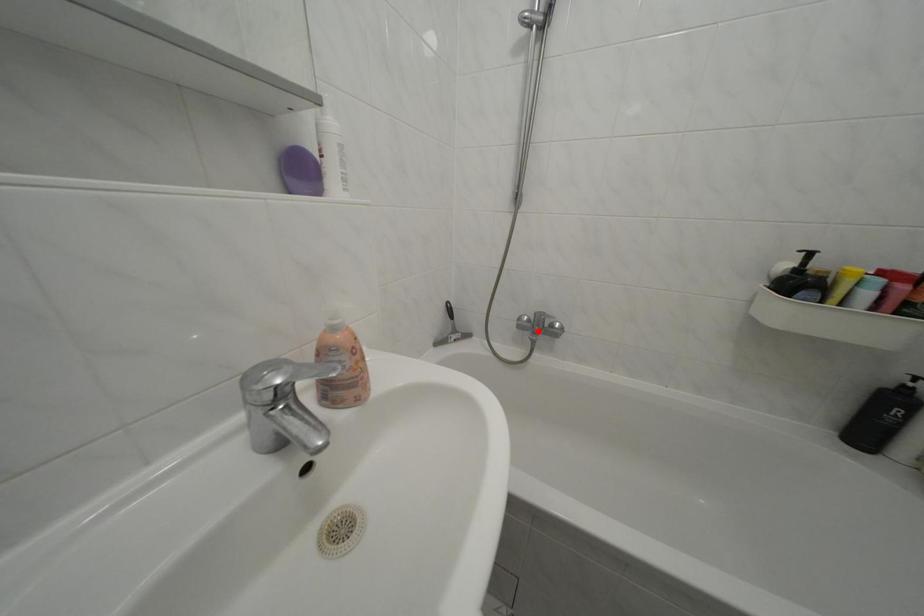
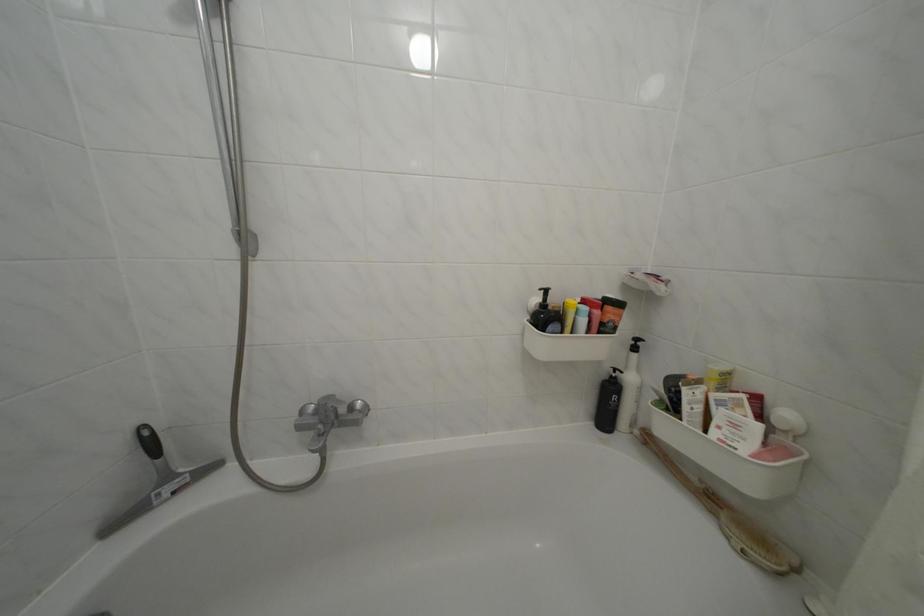
In the second image, find the point that corresponds to the highlighted location in the first image.

(323, 426)